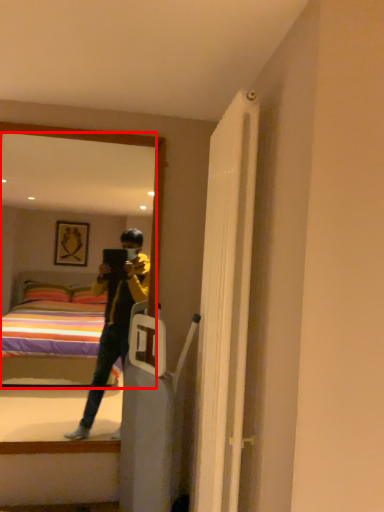
Question: From the image's perspective, what is the correct spatial positioning of mirror (annotated by the red box) in reference to door?

Choices:
 (A) below
 (B) above

Answer: (B)